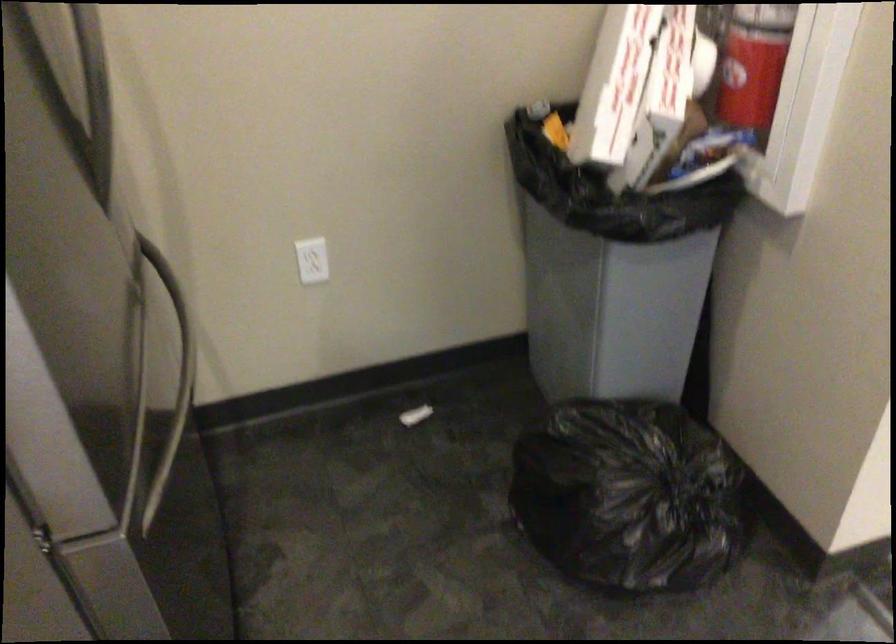
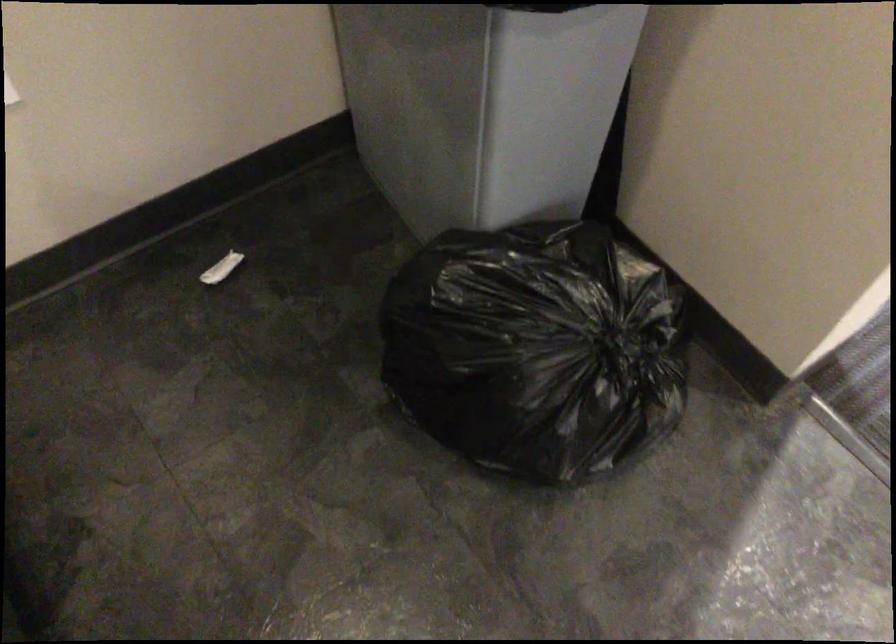
Question: The images are taken continuously from a first-person perspective. In which direction are you moving?

Choices:
 (A) Left
 (B) Right
 (C) Forward
 (D) Backward

Answer: (C)